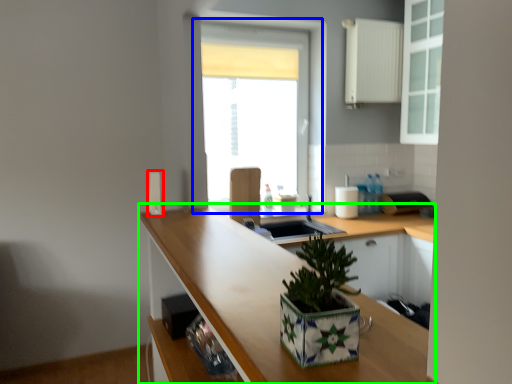
Question: Which object is the closest to the appliance (highlighted by a red box)? Choose among these: window (highlighted by a blue box) or countertop (highlighted by a green box).

Choices:
 (A) window
 (B) countertop

Answer: (B)